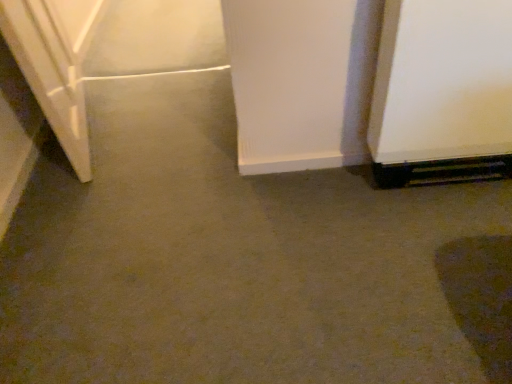
The height and width of the screenshot is (384, 512). Describe the element at coordinates (50, 74) in the screenshot. I see `white glossy door at left` at that location.

Measure the distance between white glossy door at left and camera.

The distance of white glossy door at left from camera is 3.84 feet.

Locate an element on the screen. This screenshot has height=384, width=512. white glossy door at left is located at coordinates (50, 74).

You are a GUI agent. You are given a task and a screenshot of the screen. Output one action in this format:
    pyautogui.click(x=<x>, y=<y>)
    Task: Click on the white glossy door at left
    
    Given the screenshot: What is the action you would take?
    pyautogui.click(x=50, y=74)